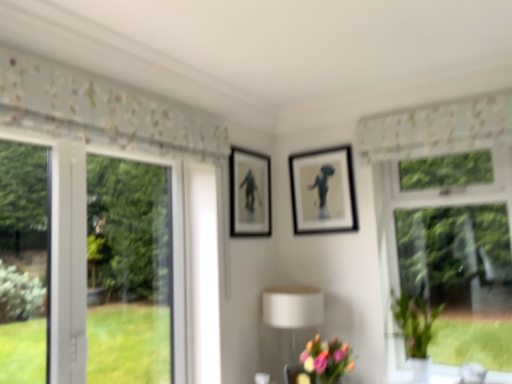
Question: Considering their positions, is pastel bouquet at lower center located in front of or behind black matte picture frame at center, which is counted as the 1th picture frame, starting from the left?

Choices:
 (A) behind
 (B) front

Answer: (B)

Question: Is pastel bouquet at lower center taller or shorter than black matte picture frame at center, which is counted as the 1th picture frame, starting from the left?

Choices:
 (A) tall
 (B) short

Answer: (B)

Question: Considering the real-world distances, which object is closest to the white matte table lamp at lower center?

Choices:
 (A) white floral fabric at upper center
 (B) pastel bouquet at lower center
 (C) matte black picture frame at center, acting as the 2th picture frame starting from the left
 (D) green glossy vase at right
 (E) black matte picture frame at center, which is counted as the second picture frame, starting from the right

Answer: (B)

Question: Based on their relative distances, which object is nearer to the white matte table lamp at lower center?

Choices:
 (A) white floral fabric at upper center
 (B) matte black picture frame at center, which is the 1th picture frame from right to left
 (C) black matte picture frame at center, which is counted as the 1th picture frame, starting from the left
 (D) pastel bouquet at lower center
 (E) green glossy vase at right

Answer: (D)